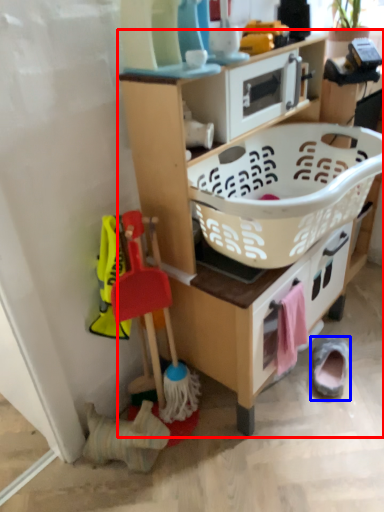
Question: Among these objects, which one is nearest to the camera, shelf (highlighted by a red box) or footwear (highlighted by a blue box)?

Choices:
 (A) shelf
 (B) footwear

Answer: (A)